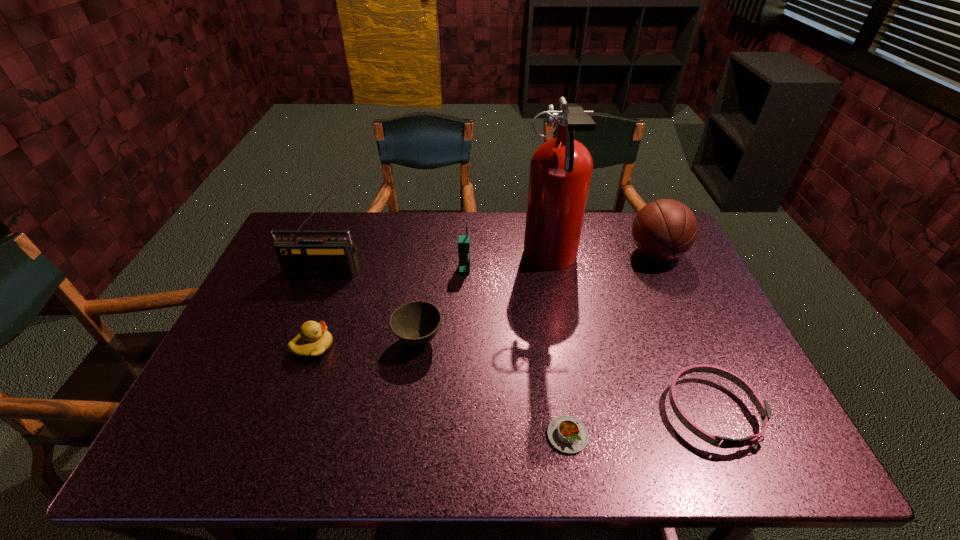
This screenshot has width=960, height=540. In order to click on vacant space that is in between the basketball and the tallest object in this screenshot , I will do `click(603, 256)`.

Locate an element on the screen. free area in between the basketball and the fire extinguisher is located at coordinates (603, 256).

Image resolution: width=960 pixels, height=540 pixels. I want to click on vacant region between the seventh shortest object and the bowl, so click(x=372, y=306).

Find the location of `free spot between the duckling and the basketball`. free spot between the duckling and the basketball is located at coordinates (485, 300).

At what (x,y) coordinates should I click in order to perform the action: click on free spot between the pudding and the bowl. Please return your answer as a coordinate pair (x, y). Image resolution: width=960 pixels, height=540 pixels. Looking at the image, I should click on (493, 388).

The image size is (960, 540). What are the coordinates of `free area in between the duckling and the radio receiver` in the screenshot? It's located at coord(320,310).

Locate an element on the screen. The height and width of the screenshot is (540, 960). empty location between the radio receiver and the fifth object from right to left is located at coordinates (396, 271).

Identify the location of free point between the third object from left to right and the tallest object. The image size is (960, 540). (484, 300).

This screenshot has height=540, width=960. I want to click on vacant point located between the duckling and the third object from left to right, so click(366, 343).

The image size is (960, 540). Identify the location of unoccupied position between the second tallest object and the duckling. (320, 310).